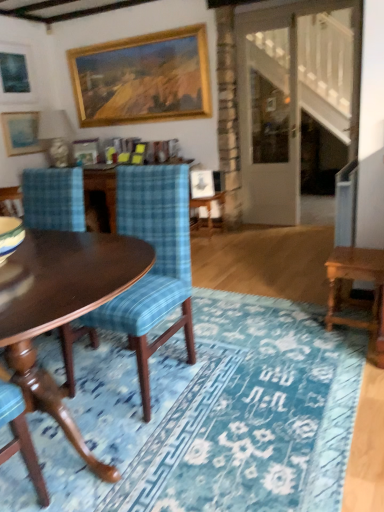
Question: Should I look upward or downward to see blue plaid fabric chair at left?

Choices:
 (A) down
 (B) up

Answer: (A)

Question: From a real-world perspective, is blue plaid fabric chair at left physically above wooden side table at center?

Choices:
 (A) yes
 (B) no

Answer: (A)

Question: Is blue plaid fabric chair at left positioned with its back to wooden side table at center?

Choices:
 (A) yes
 (B) no

Answer: (B)

Question: Does blue plaid fabric chair at left have a lesser height compared to wooden side table at center?

Choices:
 (A) yes
 (B) no

Answer: (B)

Question: From a real-world perspective, is blue plaid fabric chair at left located beneath wooden side table at center?

Choices:
 (A) no
 (B) yes

Answer: (A)

Question: Is blue plaid fabric chair at left taller than wooden side table at center?

Choices:
 (A) no
 (B) yes

Answer: (B)

Question: Considering the relative positions of blue plaid fabric chair at left and wooden side table at center in the image provided, is blue plaid fabric chair at left in front of wooden side table at center?

Choices:
 (A) no
 (B) yes

Answer: (B)

Question: Is wooden table at right placed right next to wooden picture frame at upper center, which is the 2th picture frame in right-to-left order?

Choices:
 (A) yes
 (B) no

Answer: (B)

Question: Would you say wooden table at right is a long distance from wooden picture frame at upper center, which is the 3th picture frame in left-to-right order?

Choices:
 (A) yes
 (B) no

Answer: (A)

Question: Is the position of wooden table at right less distant than that of wooden picture frame at upper center, which is the 3th picture frame in left-to-right order?

Choices:
 (A) yes
 (B) no

Answer: (A)

Question: Is wooden table at right looking in the opposite direction of wooden picture frame at upper center, which is the 3th picture frame in left-to-right order?

Choices:
 (A) no
 (B) yes

Answer: (A)

Question: Is wooden table at right positioned behind wooden picture frame at upper center, which is the 2th picture frame in right-to-left order?

Choices:
 (A) yes
 (B) no

Answer: (B)

Question: Can you confirm if wooden table at right is bigger than wooden picture frame at upper center, which is the 3th picture frame in left-to-right order?

Choices:
 (A) no
 (B) yes

Answer: (B)

Question: From a real-world perspective, is wooden picture frame at upper center, which is the 2th picture frame in right-to-left order, over blue textured rug at center?

Choices:
 (A) yes
 (B) no

Answer: (A)